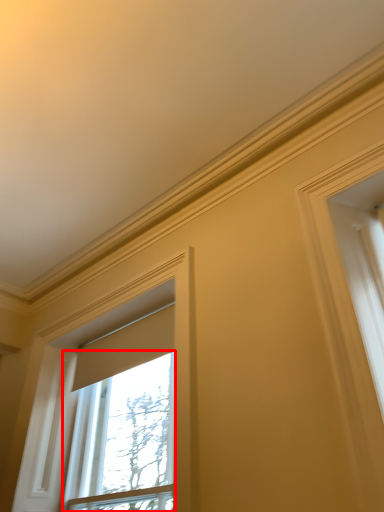
Question: Observing the image, what is the correct spatial positioning of window (annotated by the red box) in reference to window?

Choices:
 (A) right
 (B) left

Answer: (A)